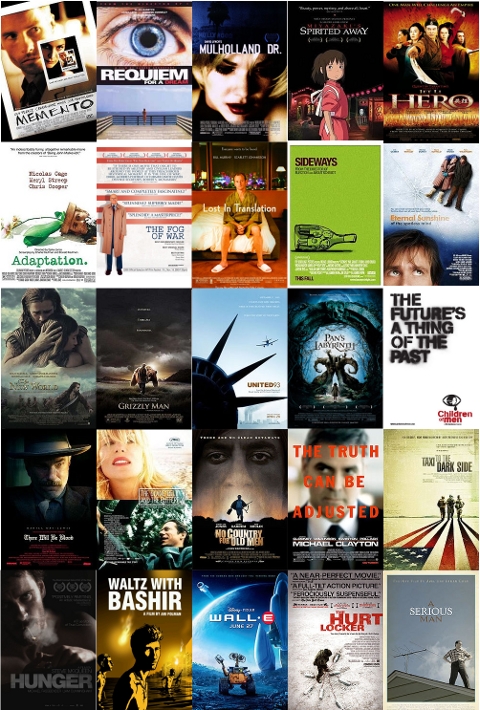
You are a GUI agent. You are given a task and a screenshot of the screen. Output one action in this format:
    pyautogui.click(x=<x>, y=<y>)
    Task: Click on the dvds in the top two rows
    The width and height of the screenshot is (480, 710).
    Given the screenshot: What is the action you would take?
    pyautogui.click(x=435, y=64), pyautogui.click(x=429, y=184), pyautogui.click(x=342, y=185), pyautogui.click(x=328, y=80), pyautogui.click(x=257, y=80), pyautogui.click(x=241, y=190), pyautogui.click(x=162, y=185), pyautogui.click(x=143, y=84), pyautogui.click(x=69, y=87), pyautogui.click(x=63, y=200)